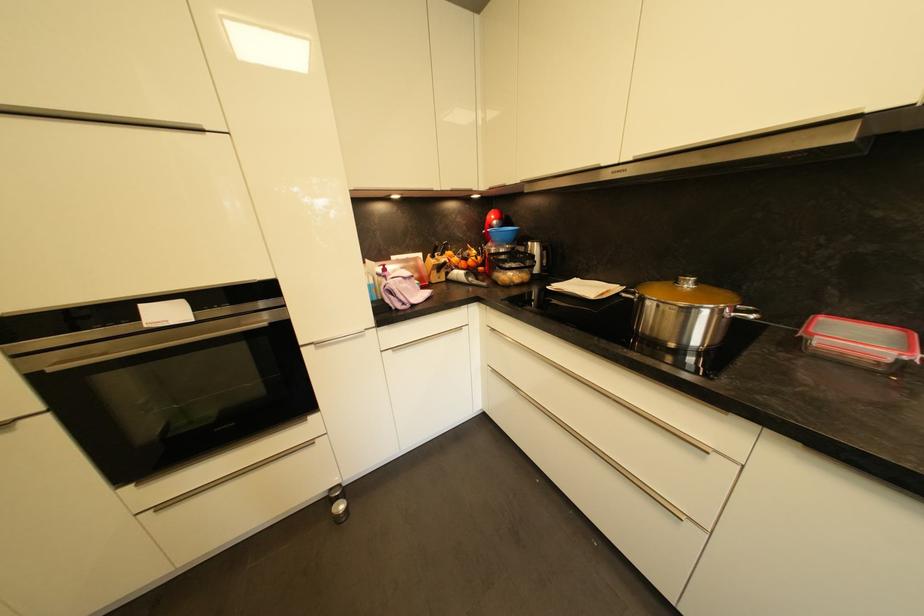
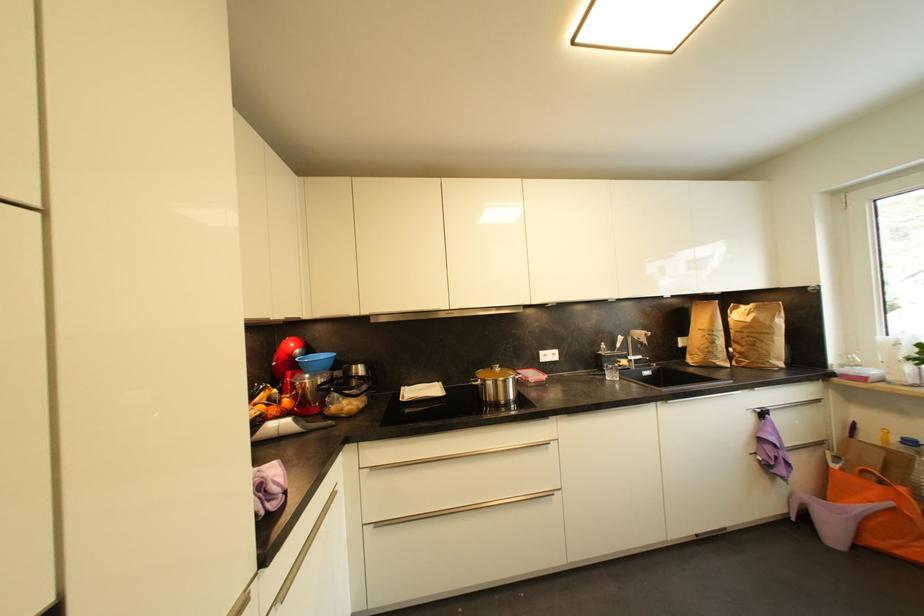
The point at (860, 320) is marked in the first image. Where is the corresponding point in the second image?

(528, 371)